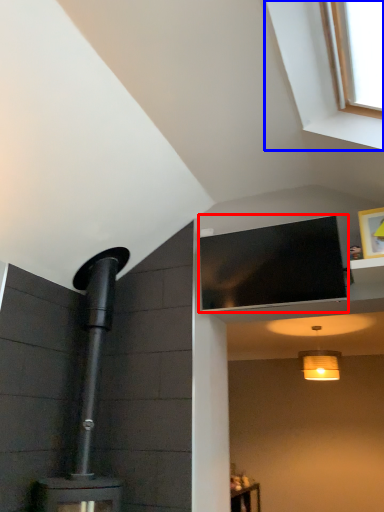
Question: Which point is further to the camera, window screen (highlighted by a red box) or window (highlighted by a blue box)?

Choices:
 (A) window screen
 (B) window

Answer: (A)